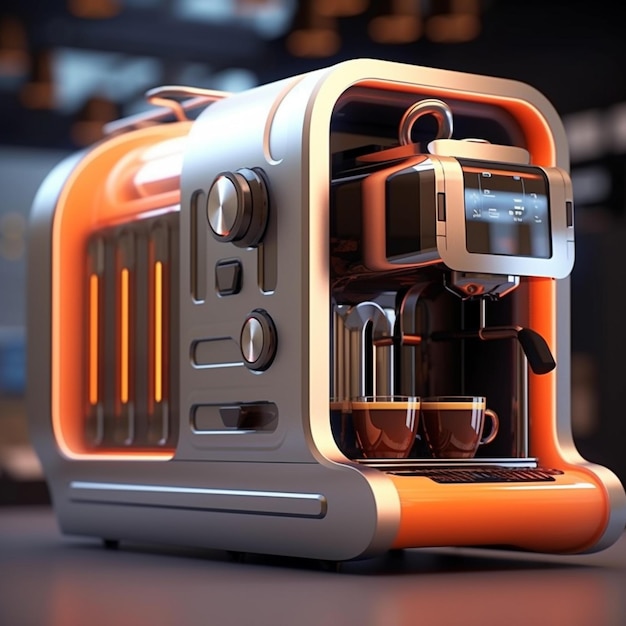
Find the location of a particular element. glass cups is located at coordinates 396,434, 462,432.